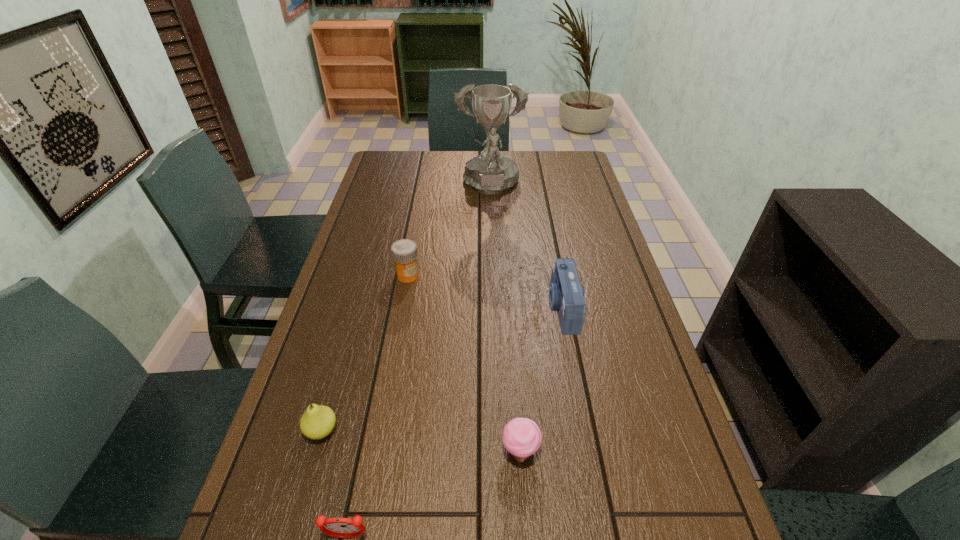
Identify the location of award. The height and width of the screenshot is (540, 960). (491, 172).

Find the location of a particular element. The width and height of the screenshot is (960, 540). the farthest object is located at coordinates (491, 172).

Image resolution: width=960 pixels, height=540 pixels. What are the coordinates of `the rightmost object` in the screenshot? It's located at (566, 295).

Locate an element on the screen. The height and width of the screenshot is (540, 960). camera is located at coordinates (566, 295).

This screenshot has height=540, width=960. Find the location of `the second farthest object`. the second farthest object is located at coordinates (404, 251).

Find the location of `pear`. pear is located at coordinates tap(318, 421).

This screenshot has width=960, height=540. Find the location of `cupcake`. cupcake is located at coordinates (522, 437).

This screenshot has width=960, height=540. In order to click on blank space located 0.340m on the side with emblem of the tallest object in this screenshot , I will do `click(492, 267)`.

You are a GUI agent. You are given a task and a screenshot of the screen. Output one action in this format:
    pyautogui.click(x=<x>, y=<y>)
    Task: Click on the free space located on the lens of the rightmost object
    The image size is (960, 540).
    Given the screenshot: What is the action you would take?
    pyautogui.click(x=509, y=308)

Find the location of `blank space located 0.360m on the lens of the rightmost object`. blank space located 0.360m on the lens of the rightmost object is located at coordinates (418, 308).